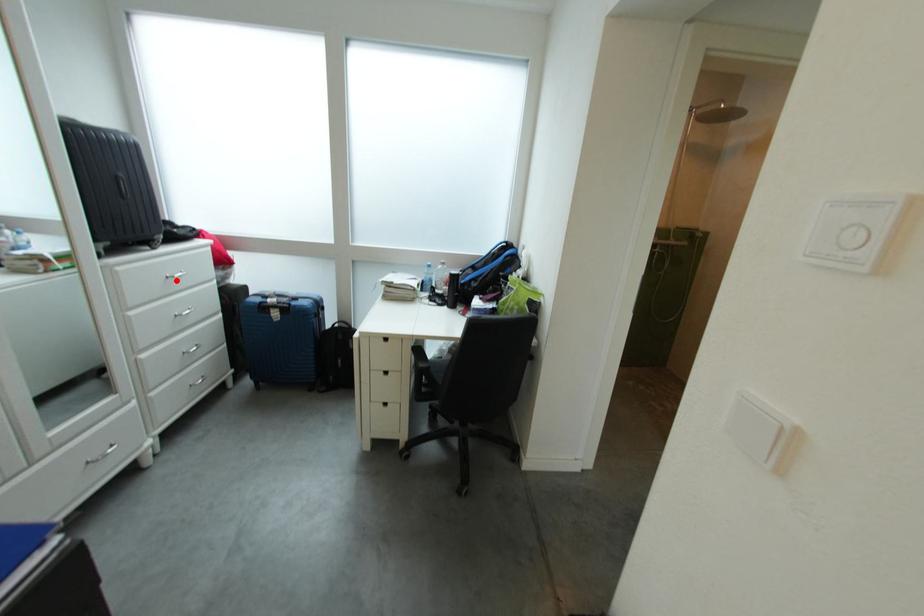
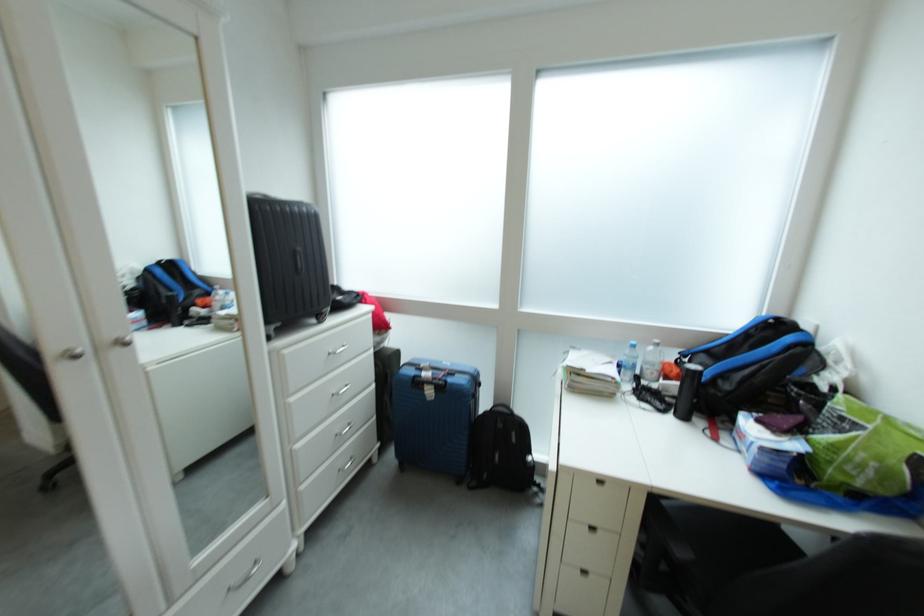
Locate, in the second image, the point that corresponds to the highlighted location in the first image.

(338, 355)